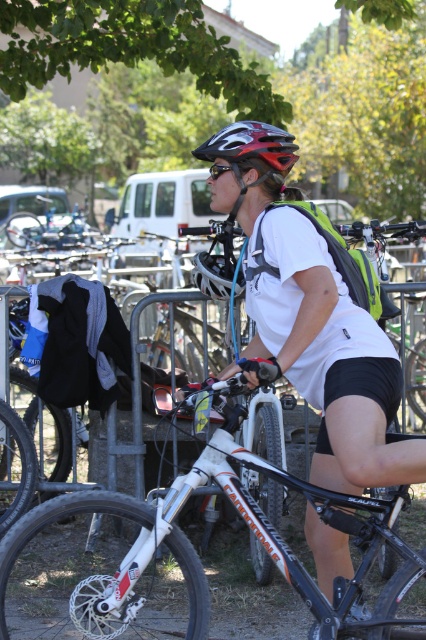
Who is taller, white matte shirt at center or black matte sunglasses at center?

Standing taller between the two is white matte shirt at center.

Is point (250, 241) closer to camera compared to point (215, 179)?

That is True.

Measure the distance between point (x=287, y=326) and camera.

A distance of 13.23 feet exists between point (x=287, y=326) and camera.

The height and width of the screenshot is (640, 426). In order to click on white matte shirt at center in this screenshot , I will do `click(310, 316)`.

From the picture: Between white matte mountain bike at center and black matte sunglasses at center, which one has less height?

Standing shorter between the two is black matte sunglasses at center.

How distant is white matte mountain bike at center from black matte sunglasses at center?

white matte mountain bike at center and black matte sunglasses at center are 6.17 feet apart.

Which is behind, point (412, 580) or point (218, 172)?

The point (218, 172) is more distant.

I want to click on white matte mountain bike at center, so click(178, 557).

Who is more distant from viewer, [301,259] or [49,524]?

Positioned behind is point [49,524].

Which is more to the left, white matte shirt at center or white matte mountain bike at center?

From the viewer's perspective, white matte mountain bike at center appears more on the left side.

Locate an element on the screen. white matte shirt at center is located at coordinates (310, 316).